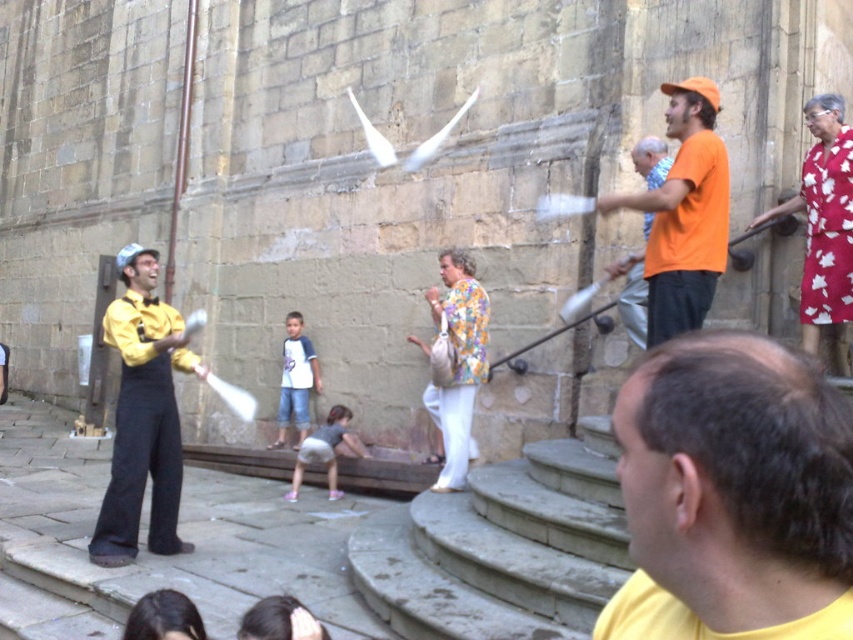
Who is lower down, yellow satin shirt at center or orange cotton shirt at right?

yellow satin shirt at center is below.

Can you confirm if yellow satin shirt at center is bigger than orange cotton shirt at right?

Actually, yellow satin shirt at center might be smaller than orange cotton shirt at right.

Which is in front, point (136, 342) or point (693, 225)?

Point (693, 225) is more forward.

You are a GUI agent. You are given a task and a screenshot of the screen. Output one action in this format:
    pyautogui.click(x=<x>, y=<y>)
    Task: Click on the yellow satin shirt at center
    This screenshot has width=853, height=640.
    Given the screenshot: What is the action you would take?
    pyautogui.click(x=143, y=416)

Is yellow matte shirt at lower right shorter than yellow satin shirt at center?

Indeed, yellow matte shirt at lower right has a lesser height compared to yellow satin shirt at center.

Consider the image. Which of these two, yellow matte shirt at lower right or yellow satin shirt at center, stands taller?

With more height is yellow satin shirt at center.

Is point (845, 416) positioned behind point (163, 445)?

No, (845, 416) is closer to viewer.

This screenshot has width=853, height=640. Identify the location of yellow matte shirt at lower right. (733, 493).

Which is below, yellow matte shirt at lower right or orange cotton shirt at right?

yellow matte shirt at lower right

Which is behind, point (621, 417) or point (653, 323)?

The point (653, 323) is more distant.

Image resolution: width=853 pixels, height=640 pixels. I want to click on yellow matte shirt at lower right, so click(x=733, y=493).